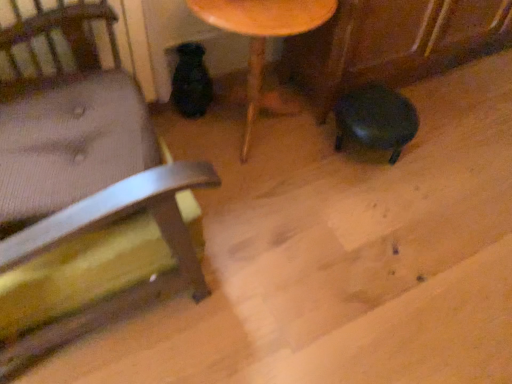
Question: Would you say matte black stool at lower right is part of wooden chair at left's contents?

Choices:
 (A) yes
 (B) no

Answer: (B)

Question: From the image's perspective, is wooden chair at left located above matte black stool at lower right?

Choices:
 (A) yes
 (B) no

Answer: (B)

Question: Can you confirm if wooden chair at left is smaller than matte black stool at lower right?

Choices:
 (A) no
 (B) yes

Answer: (A)

Question: Is wooden chair at left not within matte black stool at lower right?

Choices:
 (A) yes
 (B) no

Answer: (A)

Question: Is wooden chair at left taller than matte black stool at lower right?

Choices:
 (A) yes
 (B) no

Answer: (A)

Question: Considering the positions of wooden chair at left and matte black stool at lower right in the image, is wooden chair at left bigger or smaller than matte black stool at lower right?

Choices:
 (A) big
 (B) small

Answer: (A)

Question: From the image's perspective, is wooden chair at left located above or below matte black stool at lower right?

Choices:
 (A) above
 (B) below

Answer: (B)

Question: Is wooden chair at left in front of or behind matte black stool at lower right in the image?

Choices:
 (A) front
 (B) behind

Answer: (A)

Question: From a real-world perspective, is wooden chair at left physically located above or below matte black stool at lower right?

Choices:
 (A) below
 (B) above

Answer: (B)

Question: Is wooden table at center wider or thinner than matte black stool at lower right?

Choices:
 (A) wide
 (B) thin

Answer: (A)

Question: Relative to matte black stool at lower right, is wooden table at center in front or behind?

Choices:
 (A) front
 (B) behind

Answer: (A)

Question: From a real-world perspective, is wooden table at center physically located above or below matte black stool at lower right?

Choices:
 (A) below
 (B) above

Answer: (B)

Question: From the image's perspective, relative to matte black stool at lower right, is wooden table at center above or below?

Choices:
 (A) below
 (B) above

Answer: (B)

Question: Is matte black stool at lower right inside or outside of wooden table at center?

Choices:
 (A) outside
 (B) inside

Answer: (A)

Question: Is matte black stool at lower right wider or thinner than wooden table at center?

Choices:
 (A) wide
 (B) thin

Answer: (B)